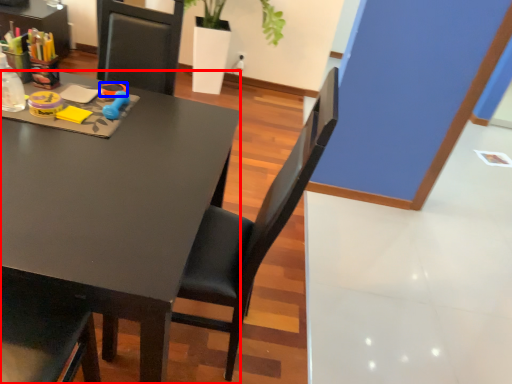
Question: Which object is further to the camera taking this photo, desk (highlighted by a red box) or scissors (highlighted by a blue box)?

Choices:
 (A) desk
 (B) scissors

Answer: (B)